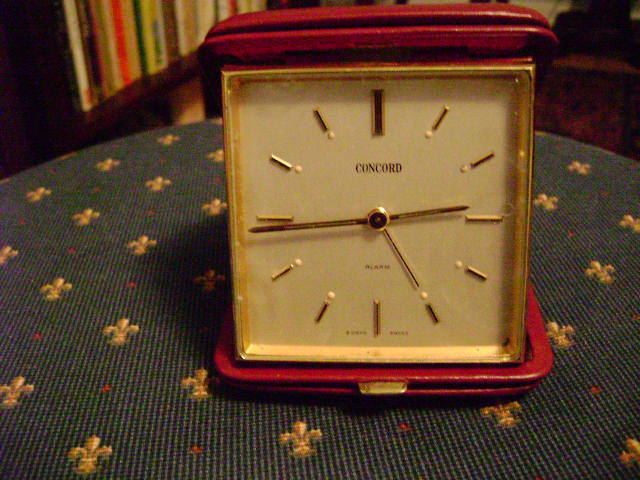
This screenshot has height=480, width=640. Find the location of `couch arm`. couch arm is located at coordinates click(152, 320).